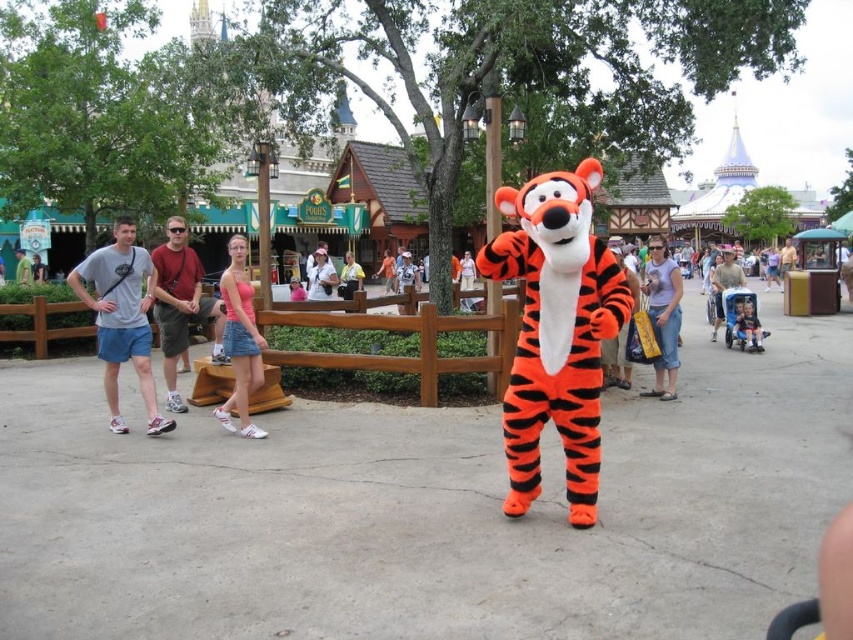
You are a photographer at the theme park and want to take a photo of the orange plush tiger at center and the pink denim shorts at center. Which object should you focus on first if you want to capture both in the same frame without moving the camera?

The orange plush tiger at center has a smaller size compared to pink denim shorts at center, so you should focus on the orange plush tiger at center first to ensure it is in clear view before adjusting for the larger pink denim shorts at center.